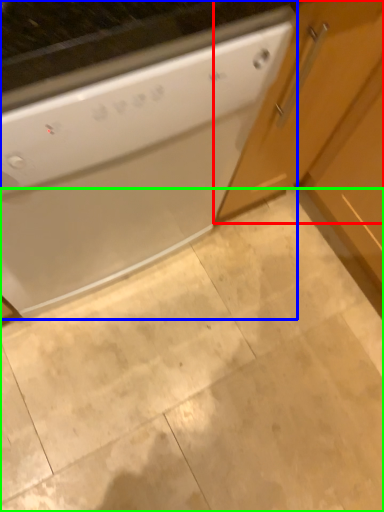
Question: Which object is the farthest from cabinetry (highlighted by a red box)? Choose among these: home appliance (highlighted by a blue box) or granite (highlighted by a green box).

Choices:
 (A) home appliance
 (B) granite

Answer: (B)